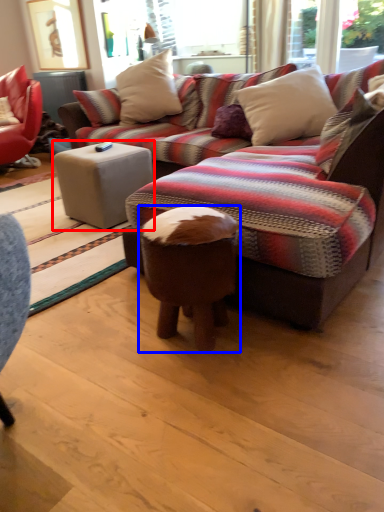
Question: Among these objects, which one is nearest to the camera, table (highlighted by a red box) or bar stool (highlighted by a blue box)?

Choices:
 (A) table
 (B) bar stool

Answer: (B)